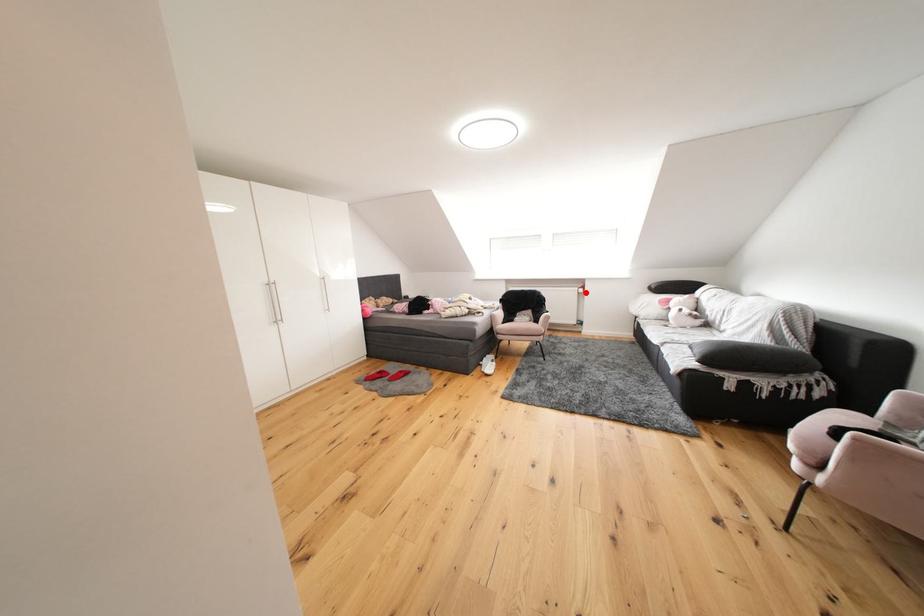
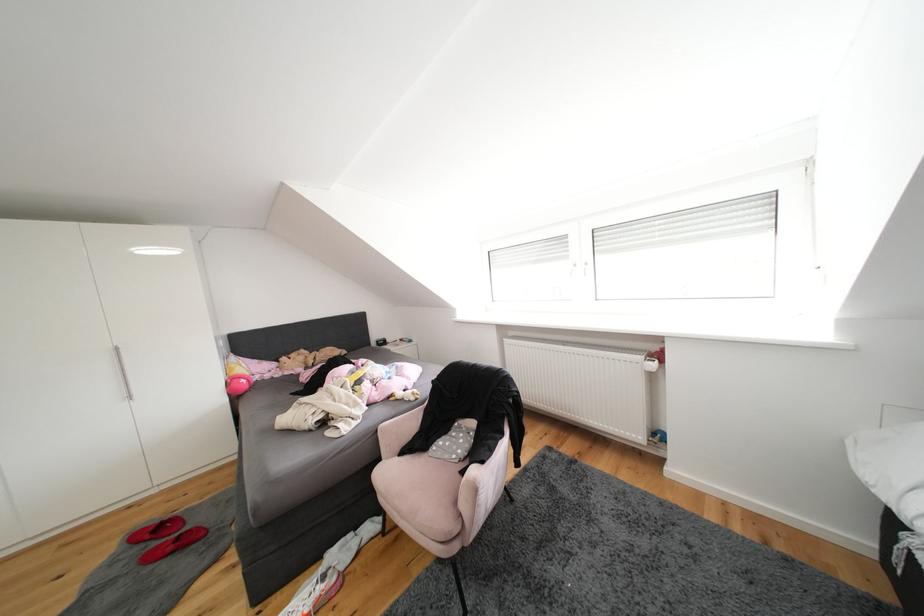
In the second image, find the point that corresponds to the highlighted location in the first image.

(650, 362)